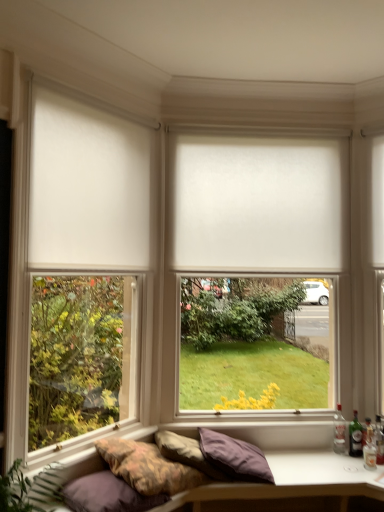
At what (x,y) coordinates should I click in order to perform the action: click on blank space situated above white matte window at center (from a real-world perspective). Please return your answer as a coordinate pair (x, y). The height and width of the screenshot is (512, 384). Looking at the image, I should click on (249, 113).